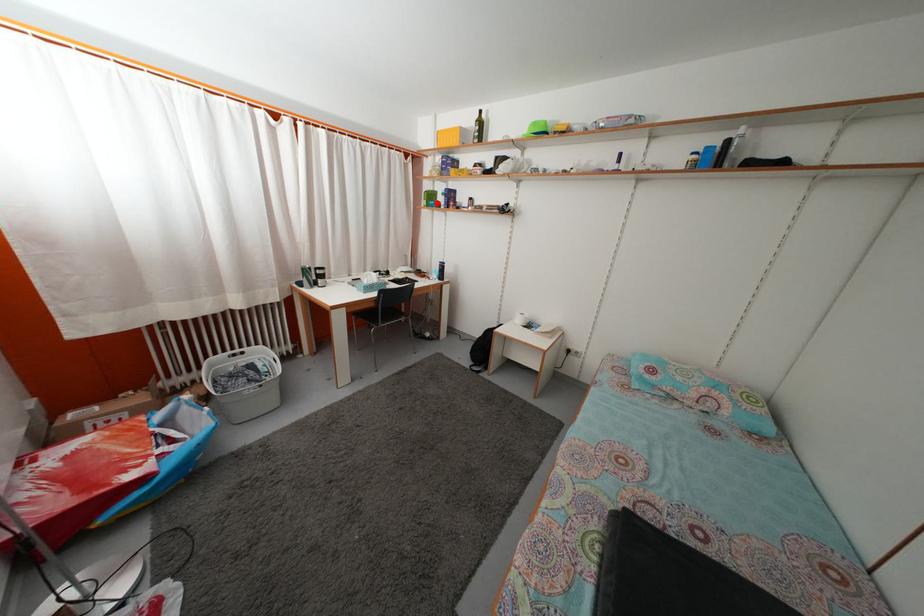
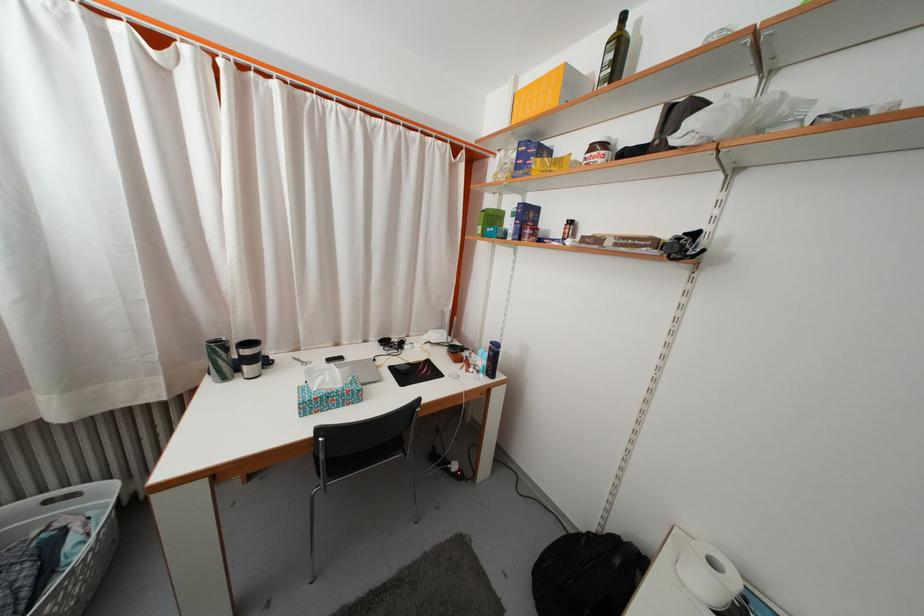
In the second image, find the point that corresponds to the highlighted location in the first image.

(500, 225)